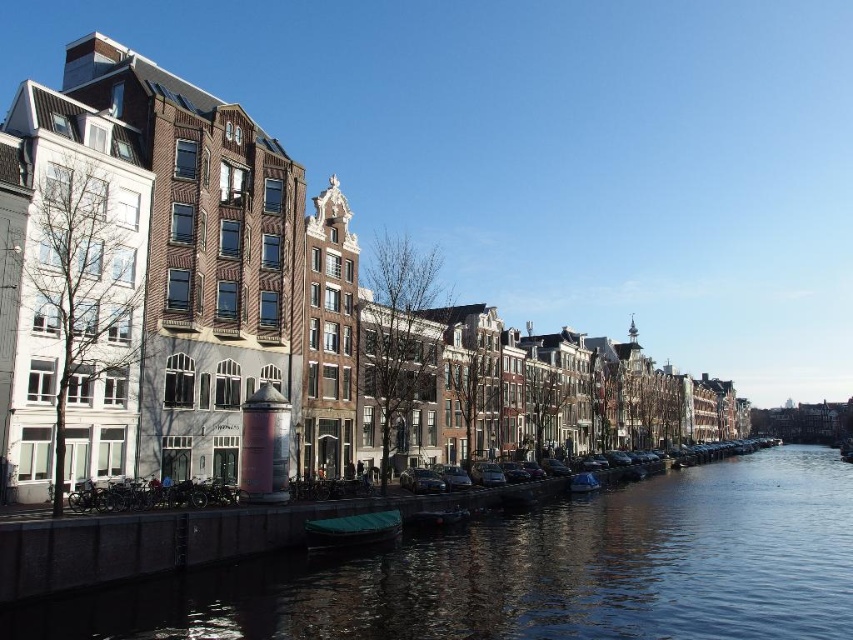
Does point (341, 522) come farther from viewer compared to point (579, 481)?

That is False.

Locate an element on the screen. This screenshot has height=640, width=853. green matte boat at lower center is located at coordinates (352, 531).

Is smooth concrete water at center wider than blue plastic boat at lower center?

Indeed, smooth concrete water at center has a greater width compared to blue plastic boat at lower center.

Is point (473, 602) positioned behind point (585, 472)?

No, it is in front of (585, 472).

Identify the location of smooth concrete water at center. (535, 572).

Is point (729, 548) less distant than point (332, 547)?

No, (729, 548) is behind (332, 547).

Is smooth concrete water at center bigger than green matte boat at lower center?

Yes, smooth concrete water at center is bigger than green matte boat at lower center.

Is point (498, 576) farther from camera compared to point (354, 515)?

No, (498, 576) is in front of (354, 515).

Identify the location of smooth concrete water at center. coord(535,572).